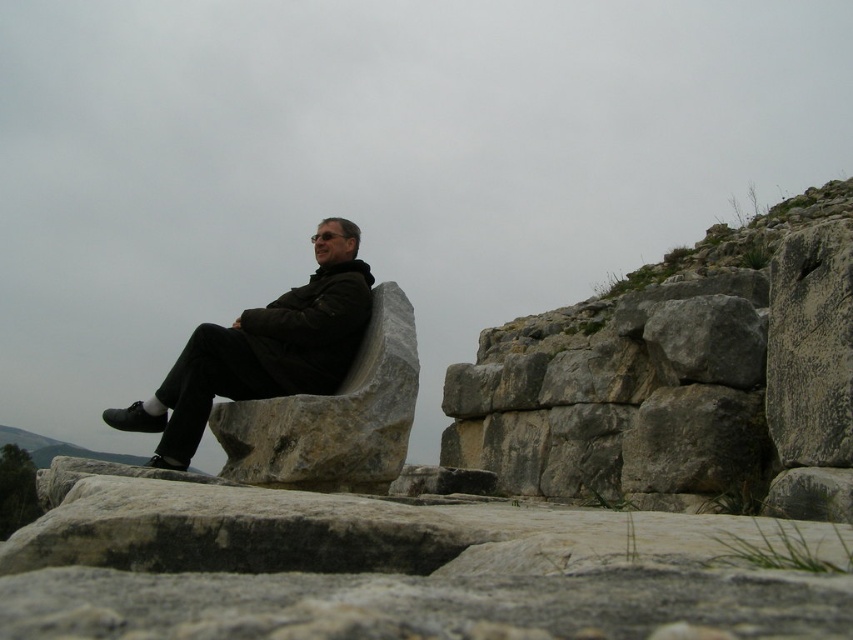
Question: Which of the following is the farthest from the observer?

Choices:
 (A) matte black jacket at center
 (B) gray stone boulder at center

Answer: (A)

Question: Is matte black jacket at center below gray stone boulder at center?

Choices:
 (A) no
 (B) yes

Answer: (A)

Question: Can you confirm if matte black jacket at center is positioned to the left of gray stone boulder at center?

Choices:
 (A) no
 (B) yes

Answer: (B)

Question: Among these points, which one is nearest to the camera?

Choices:
 (A) (322, 257)
 (B) (408, 385)

Answer: (B)

Question: Which object appears farthest from the camera in this image?

Choices:
 (A) gray stone boulder at center
 (B) matte black jacket at center

Answer: (B)

Question: From the image, what is the correct spatial relationship of matte black jacket at center in relation to gray stone boulder at center?

Choices:
 (A) left
 (B) right

Answer: (A)